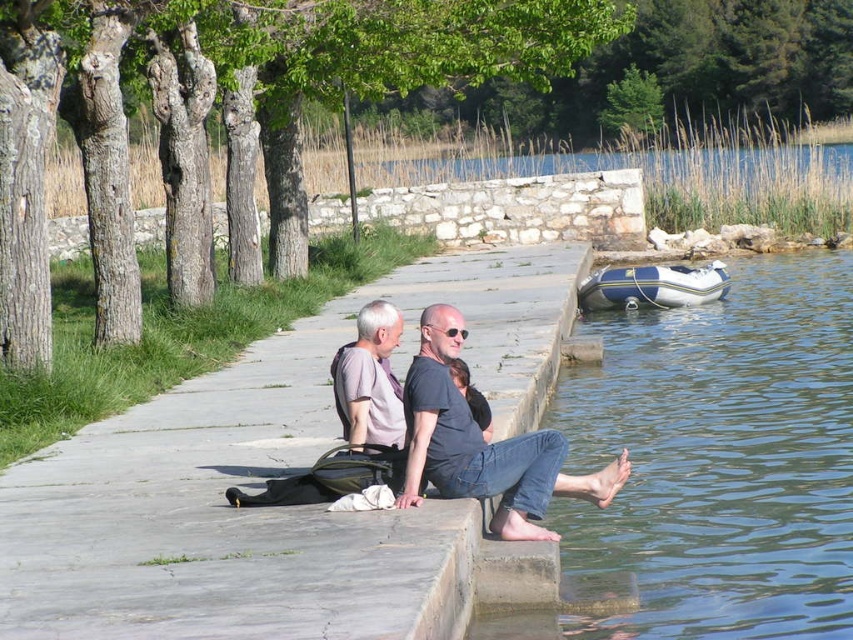
You are planning to take a photo of the gray fabric shirt at center and the white rubber boat at lower right. Which object should you focus on first if you want to capture both in the frame without moving the camera?

You should focus on the gray fabric shirt at center first because it occupies less space than the white rubber boat at lower right, so it can be framed more easily while ensuring the larger boat is also in view.

You are standing on the pier and want to take a photo of the gray fabric shirt at center without the white rubber boat at lower right appearing in the background. Is this possible?

Yes, because the gray fabric shirt at center is in front of the white rubber boat at lower right, so the boat will be hidden behind the shirt in the photo.

You are planning to launch a boat from the pier. You see the blue rubber boat at lower left and the white rubber boat at lower right. Which boat is closer to the water surface?

The blue rubber boat at lower left is below the white rubber boat at lower right, so it is closer to the water surface.